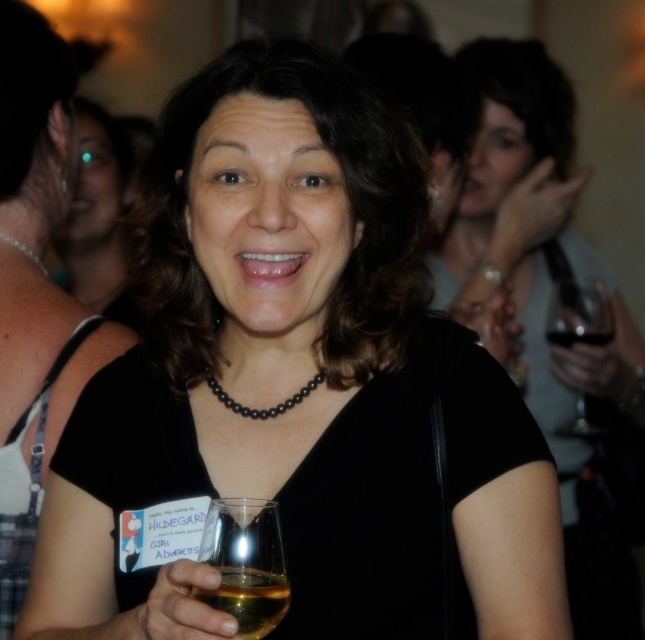
You are a bartender at a party and need to serve a drink to HILDEGARD. You see the clear glass wine glass at lower center and the clear glass wine at center. Which one should you hand to her?

You should hand her the clear glass wine glass at lower center because it is in front of the clear glass wine at center, indicating it is closer to her and ready to be picked up.

You are a bartender at a party and need to place a new drink on the table. The table has limited space between the matte black dress at center and the clear glass wine at center. What is the minimum space required between them to fit a drink coaster that is 5 inches in diameter?

The distance between the matte black dress at center and the clear glass wine at center is 18.89 inches. Since the coaster requires 5 inches of space, there is sufficient space to place it between them.